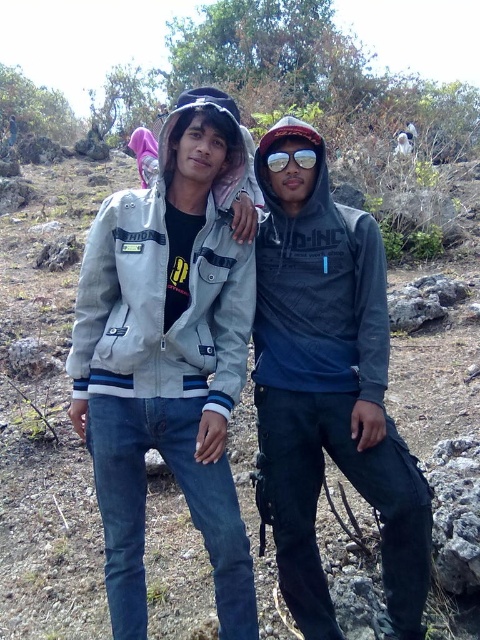
Does matte blue hoodie at center come behind sunglasses at center?

That is False.

Does matte blue hoodie at center have a smaller size compared to sunglasses at center?

No.

Who is more distant from viewer, [304,564] or [291,154]?

Point [304,564]

You are a GUI agent. You are given a task and a screenshot of the screen. Output one action in this format:
    pyautogui.click(x=<x>, y=<y>)
    Task: Click on the matte blue hoodie at center
    Image resolution: width=480 pixels, height=640 pixels.
    Given the screenshot: What is the action you would take?
    pyautogui.click(x=328, y=388)

Which is behind, point (352, 394) or point (274, 163)?

Point (274, 163)

Which is above, light gray fabric jacket at center or sunglasses at center?

sunglasses at center is above.

Does point (180, 420) come farther from viewer compared to point (313, 150)?

That is False.

Locate an element on the screen. The height and width of the screenshot is (640, 480). light gray fabric jacket at center is located at coordinates (233, 355).

Is light gray fabric jacket at center behind matte blue hoodie at center?

No, light gray fabric jacket at center is in front of matte blue hoodie at center.

Is light gray fabric jacket at center below matte blue hoodie at center?

Indeed, light gray fabric jacket at center is positioned under matte blue hoodie at center.

Does point (121, 296) lie behind point (298, 372)?

No, it is in front of (298, 372).

Find the location of a particular element. The width and height of the screenshot is (480, 640). light gray fabric jacket at center is located at coordinates (233, 355).